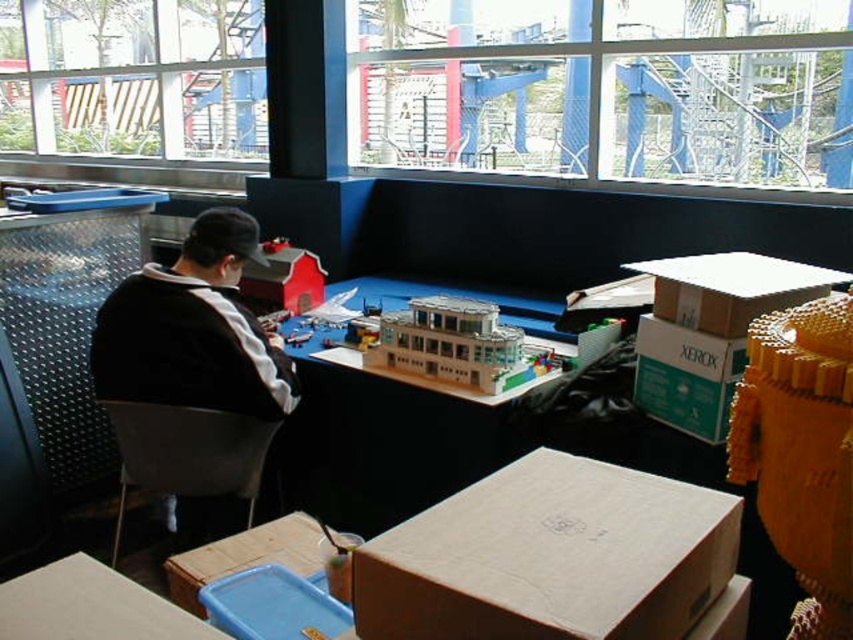
Who is more forward, (x=109, y=387) or (x=212, y=435)?

Point (x=212, y=435) is more forward.

Between black fabric jacket at left and gray plastic chair at lower left, which one has more height?

black fabric jacket at left

What do you see at coordinates (193, 330) in the screenshot? I see `black fabric jacket at left` at bounding box center [193, 330].

Find the location of `black fabric jacket at left`. black fabric jacket at left is located at coordinates (193, 330).

Who is positioned more to the right, white cardboard box at upper right or brown cardboard box at lower center?

white cardboard box at upper right is more to the right.

Who is higher up, white cardboard box at upper right or brown cardboard box at lower center?

white cardboard box at upper right is above.

Measure the distance between white cardboard box at upper right and camera.

5.03 feet

Locate an element on the screen. Image resolution: width=853 pixels, height=640 pixels. white cardboard box at upper right is located at coordinates (730, 289).

Between brown cardboard box at lower center and matte plastic barn at upper center, which one appears on the right side from the viewer's perspective?

brown cardboard box at lower center

Does point (194, 595) lie in front of point (285, 257)?

Yes, it is in front of point (285, 257).

The width and height of the screenshot is (853, 640). What are the coordinates of `brown cardboard box at lower center` in the screenshot? It's located at (247, 556).